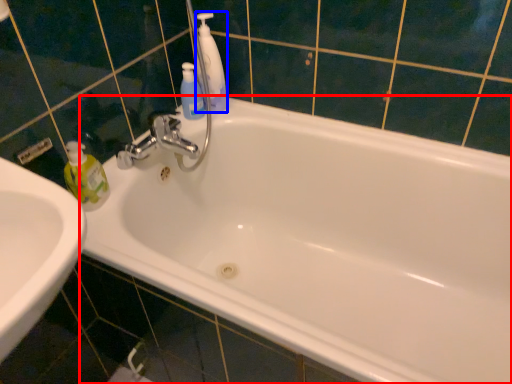
Question: Which of the following is the closest to the observer, bathtub (highlighted by a red box) or cleaning product (highlighted by a blue box)?

Choices:
 (A) bathtub
 (B) cleaning product

Answer: (A)